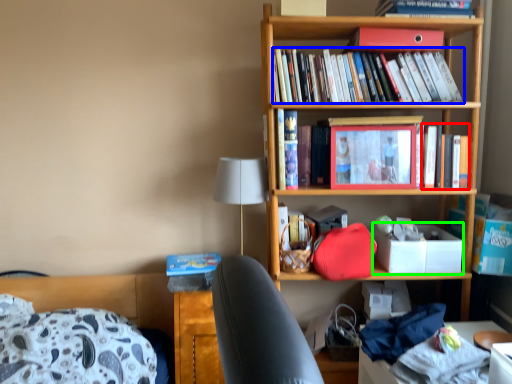
Question: Based on their relative distances, which object is nearer to book (highlighted by a red box)? Choose from book (highlighted by a blue box) and box (highlighted by a green box).

Choices:
 (A) book
 (B) box

Answer: (B)